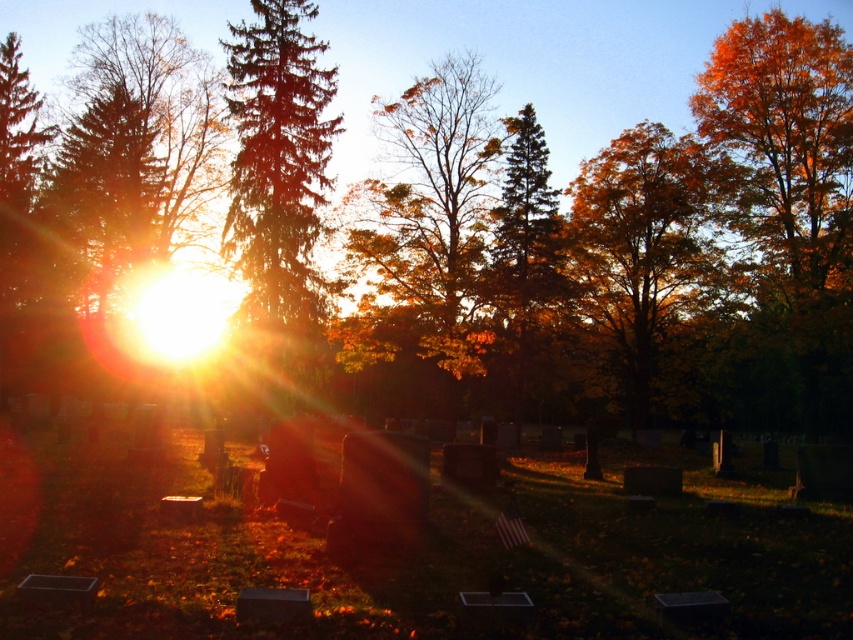
Between autumn leaves at center and orange leafy tree at center, which one has more height?

Standing taller between the two is autumn leaves at center.

Based on the photo, is autumn leaves at center bigger than orange leafy tree at center?

Actually, autumn leaves at center might be smaller than orange leafy tree at center.

Which is in front, point (393, 109) or point (721, 186)?

Point (393, 109) is in front.

At what (x,y) coordinates should I click in order to perform the action: click on autumn leaves at center. Please return your answer as a coordinate pair (x, y). This screenshot has width=853, height=640. Looking at the image, I should click on (426, 230).

Can you confirm if orange leafy tree at center is positioned below green matte evergreen tree at center?

No.

Is orange leafy tree at center bigger than green matte evergreen tree at center?

Indeed, orange leafy tree at center has a larger size compared to green matte evergreen tree at center.

Is point (648, 147) positioned before point (514, 132)?

No, (648, 147) is behind (514, 132).

Locate an element on the screen. This screenshot has height=640, width=853. orange leafy tree at center is located at coordinates (643, 257).

Can you confirm if autumn leaves at center is positioned to the right of green glossy tree at center?

Yes, autumn leaves at center is to the right of green glossy tree at center.

Based on the photo, does autumn leaves at center have a smaller size compared to green glossy tree at center?

Actually, autumn leaves at center might be larger than green glossy tree at center.

This screenshot has width=853, height=640. Describe the element at coordinates (426, 230) in the screenshot. I see `autumn leaves at center` at that location.

The height and width of the screenshot is (640, 853). In order to click on autumn leaves at center in this screenshot , I will do [426, 230].